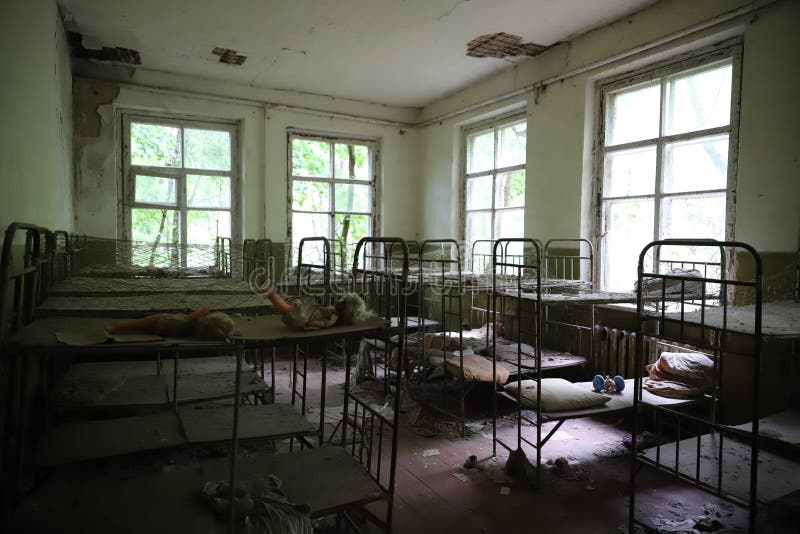
Locate an element on the screen. mullion is located at coordinates (661, 172), (493, 193), (332, 204), (182, 200).